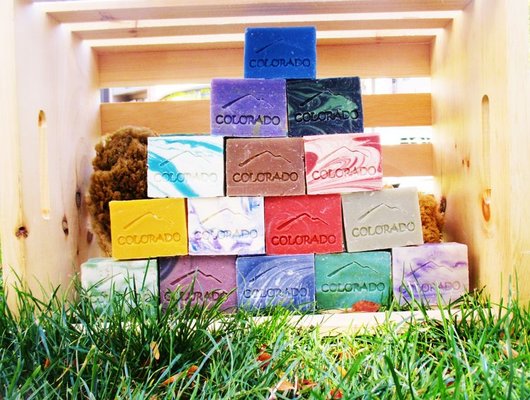
Find the location of a particular element. The width and height of the screenshot is (530, 400). wooden case is located at coordinates (54, 130).